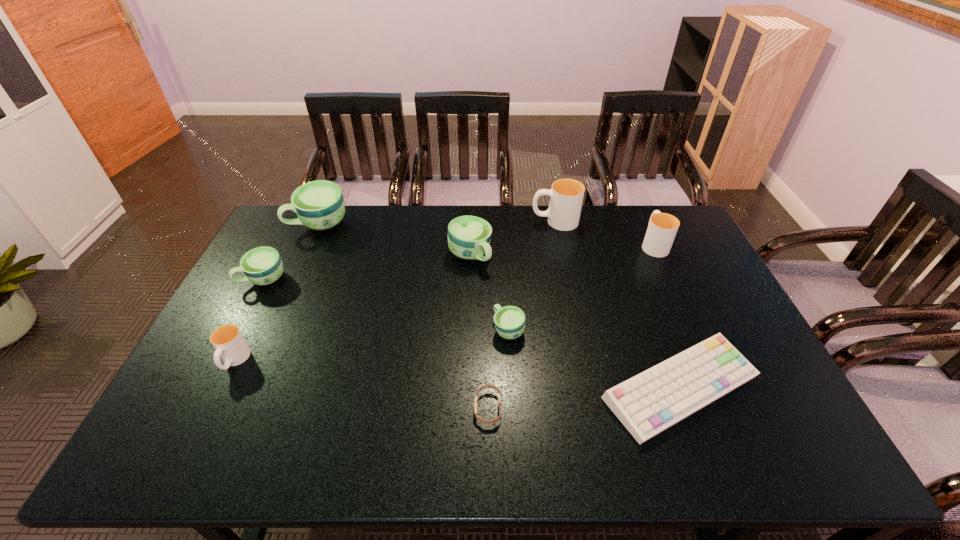
At what (x,y) coordinates should I click in order to perform the action: click on object present at the near edge. Please return your answer as a coordinate pair (x, y). This screenshot has height=540, width=960. Looking at the image, I should click on (647, 404).

At what (x,y) coordinates should I click in order to perform the action: click on cup at the right edge. Please return your answer as a coordinate pair (x, y). The height and width of the screenshot is (540, 960). Looking at the image, I should click on (662, 228).

You are a GUI agent. You are given a task and a screenshot of the screen. Output one action in this format:
    pyautogui.click(x=<x>, y=<y>)
    Task: Click on the computer keyboard that is at the right edge
    
    Given the screenshot: What is the action you would take?
    pyautogui.click(x=647, y=404)

Locate an element on the screen. object at the far left corner is located at coordinates (319, 205).

This screenshot has height=540, width=960. I want to click on object situated at the far right corner, so click(662, 228).

Locate an element on the screen. This screenshot has height=540, width=960. object that is at the near right corner is located at coordinates (647, 404).

Image resolution: width=960 pixels, height=540 pixels. Identify the location of vacant space at the far edge of the desktop. (465, 212).

You are a GUI agent. You are given a task and a screenshot of the screen. Output one action in this format:
    pyautogui.click(x=<x>, y=<y>)
    Task: Click on the free space at the near edge of the desktop
    The width and height of the screenshot is (960, 540).
    Given the screenshot: What is the action you would take?
    pyautogui.click(x=690, y=433)

Where is `blank space at the left edge of the desktop`? The width and height of the screenshot is (960, 540). blank space at the left edge of the desktop is located at coordinates (251, 294).

In the image, there is a desktop. Where is `vacant space at the far left corner`? The height and width of the screenshot is (540, 960). vacant space at the far left corner is located at coordinates (290, 225).